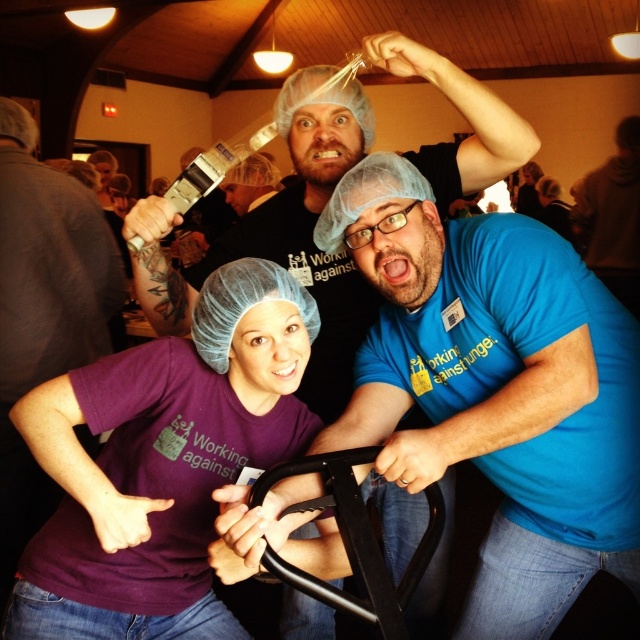
You are organizing a clothing drive and need to determine which purple shirt between the purple matte shirt at center and the purple fabric shirt at left can accommodate a larger patch. Based on their widths, which one would be suitable?

The purple matte shirt at center has a greater width than the purple fabric shirt at left, so it can accommodate a larger patch.

You are a photographer holding a camera. You want to take a photo of the purple matte shirt at center without moving the shirt. Can you do it from your current position?

A: The purple matte shirt at center and camera are 1.07 meters apart, so yes, you can take the photo from your current position as the distance is sufficient.

You are standing in the scene and want to hand a tool to both the blue matte shirt at center and the purple fabric shirt at left. Which one should you approach first to ensure you can reach them without moving too far from your current position?

You should approach the blue matte shirt at center first because it is closer to the viewer than the purple fabric shirt at left, so you can reach them without moving as far.